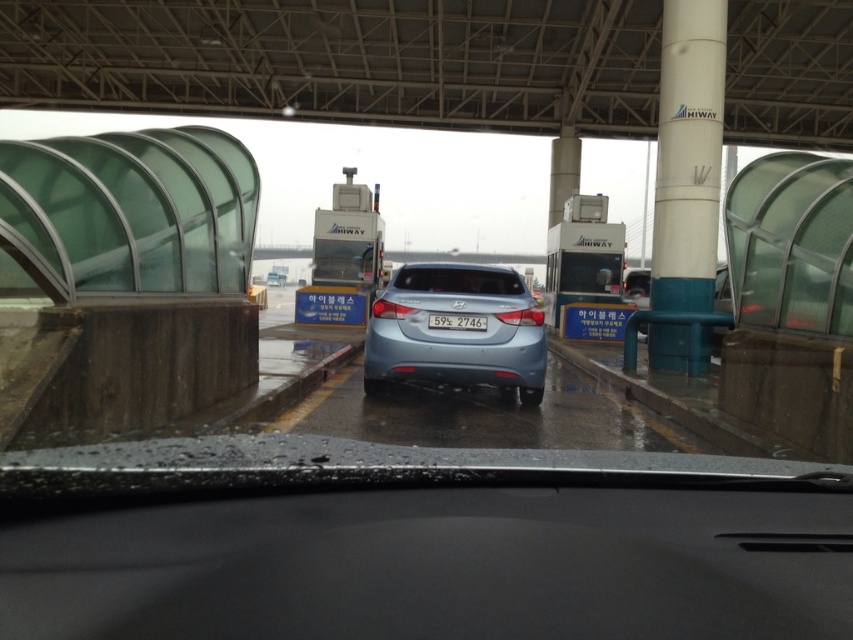
You are a driver approaching the toll booth and notice two white objects in your view. The first is the white glossy pole at upper right, and the second is the white plastic license plate at center. Which of these two objects is positioned to the right side of the other?

The white glossy pole at upper right is positioned to the right of the white plastic license plate at center.

You are a driver approaching a toll booth and see the satin blue sedan at center and the white plastic license plate at center in your view. Which object takes up more space in your field of view?

The satin blue sedan at center is larger in size than the white plastic license plate at center, so it takes up more space in the field of view.

You are driving a car and need to know if your vehicle is wider than its license plate. Based on the scene, can you determine if the satin blue sedan at center is wider than the white plastic license plate at center?

The satin blue sedan at center is wider than the white plastic license plate at center according to the description provided.